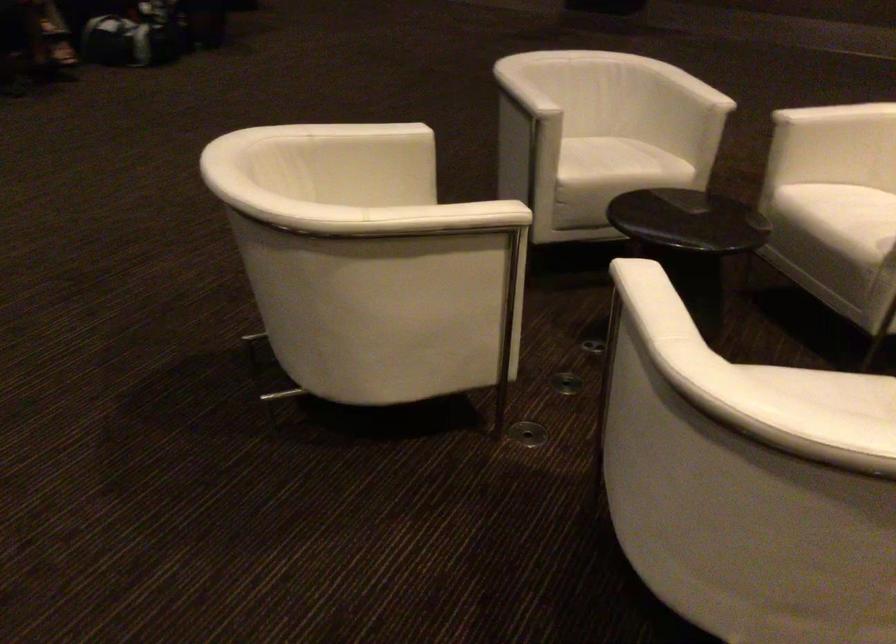
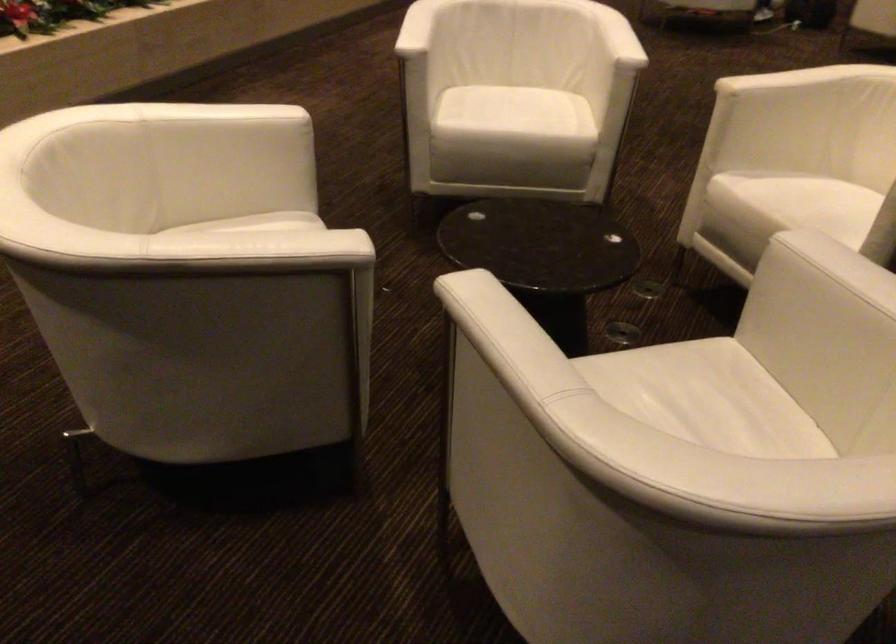
In the second image, find the point that corresponds to pixel 763 377 in the first image.

(524, 117)